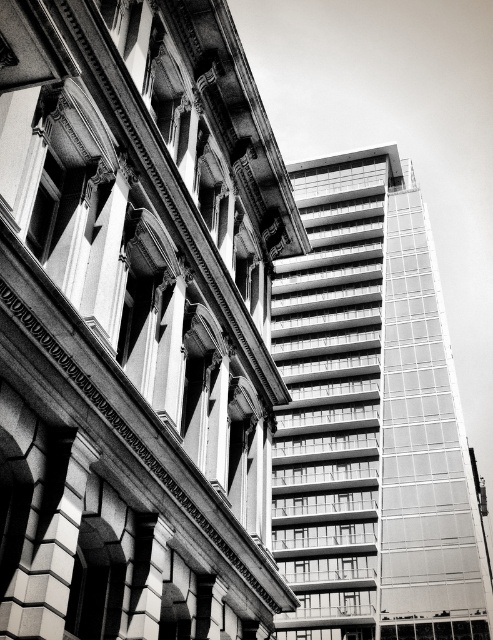
Between smooth glass skyscraper at center and glassy reflective building at right, which one is positioned lower?

Positioned lower is smooth glass skyscraper at center.

Between point (105, 13) and point (285, 433), which one is positioned in front?

Point (105, 13) is more forward.

At what (x,y) coordinates should I click in order to perform the action: click on smooth glass skyscraper at center. Please return your answer as a coordinate pair (x, y). Looking at the image, I should click on (137, 323).